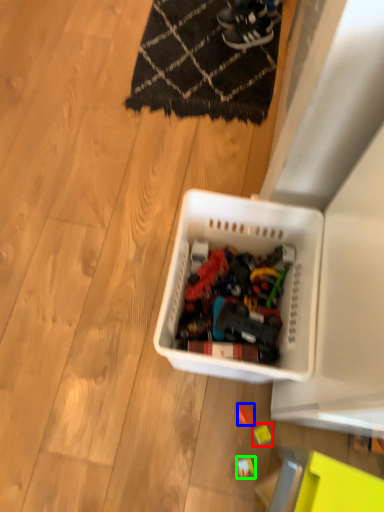
Question: Which object is positioned closest to toy (highlighted by a red box)? Select from toy (highlighted by a blue box) and toy (highlighted by a green box).

Choices:
 (A) toy
 (B) toy

Answer: (A)